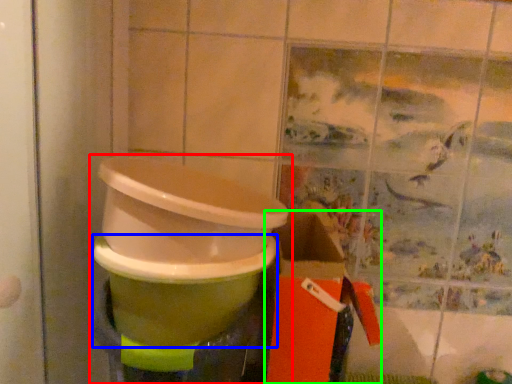
Question: Which is farther away from waste container (highlighted by a red box)? toilet bowl (highlighted by a blue box) or box (highlighted by a green box)?

Choices:
 (A) toilet bowl
 (B) box

Answer: (B)